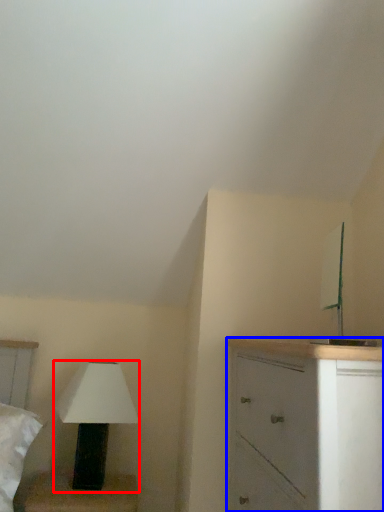
Question: Among these objects, which one is farthest to the camera, lamp (highlighted by a red box) or chest of drawers (highlighted by a blue box)?

Choices:
 (A) lamp
 (B) chest of drawers

Answer: (A)